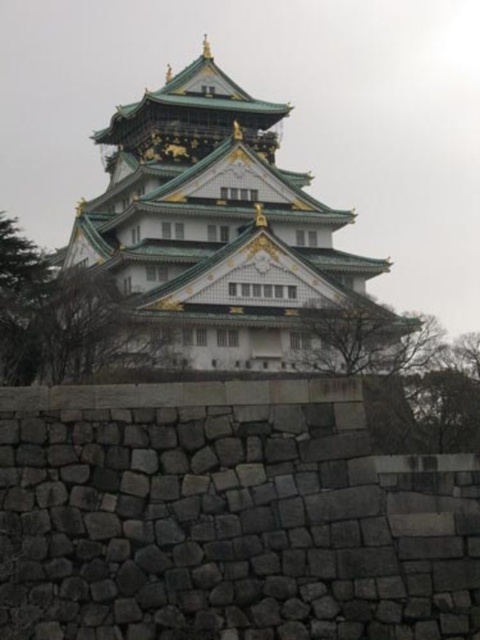
Question: Can you confirm if gray stone wall at lower center is positioned below green glazed tile tower at center?

Choices:
 (A) yes
 (B) no

Answer: (A)

Question: Considering the relative positions of gray stone wall at lower center and green glazed tile tower at center in the image provided, where is gray stone wall at lower center located with respect to green glazed tile tower at center?

Choices:
 (A) right
 (B) left

Answer: (A)

Question: Can you confirm if gray stone wall at lower center is smaller than green glazed tile tower at center?

Choices:
 (A) no
 (B) yes

Answer: (B)

Question: Which point is closer to the camera?

Choices:
 (A) gray stone wall at lower center
 (B) green glazed tile tower at center

Answer: (A)